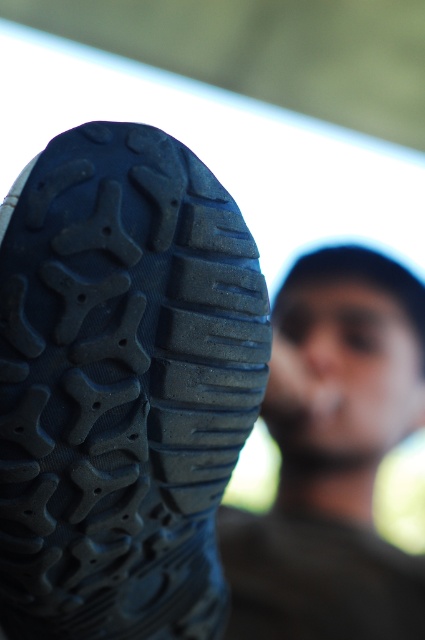
Between black rubber shoe at lower left and dark brown leather shoe at lower left, which one appears on the left side from the viewer's perspective?

Positioned to the left is black rubber shoe at lower left.

Who is shorter, black rubber shoe at lower left or dark brown leather shoe at lower left?

Standing shorter between the two is black rubber shoe at lower left.

Is point (2, 372) farther from camera compared to point (399, 298)?

No, (2, 372) is closer to viewer.

You are a GUI agent. You are given a task and a screenshot of the screen. Output one action in this format:
    pyautogui.click(x=<x>, y=<y>)
    Task: Click on the black rubber shoe at lower left
    The height and width of the screenshot is (640, 425).
    Given the screenshot: What is the action you would take?
    pyautogui.click(x=121, y=385)